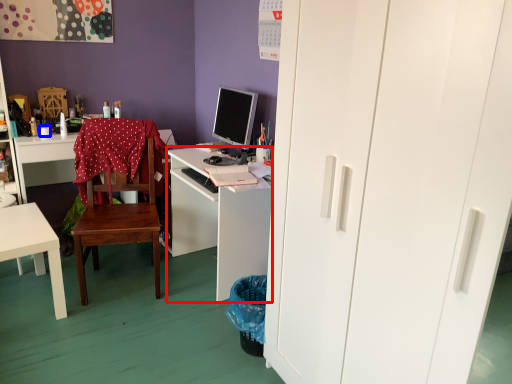
Question: Which object is closer to the camera taking this photo, desk (highlighted by a red box) or coffee cup (highlighted by a blue box)?

Choices:
 (A) desk
 (B) coffee cup

Answer: (A)